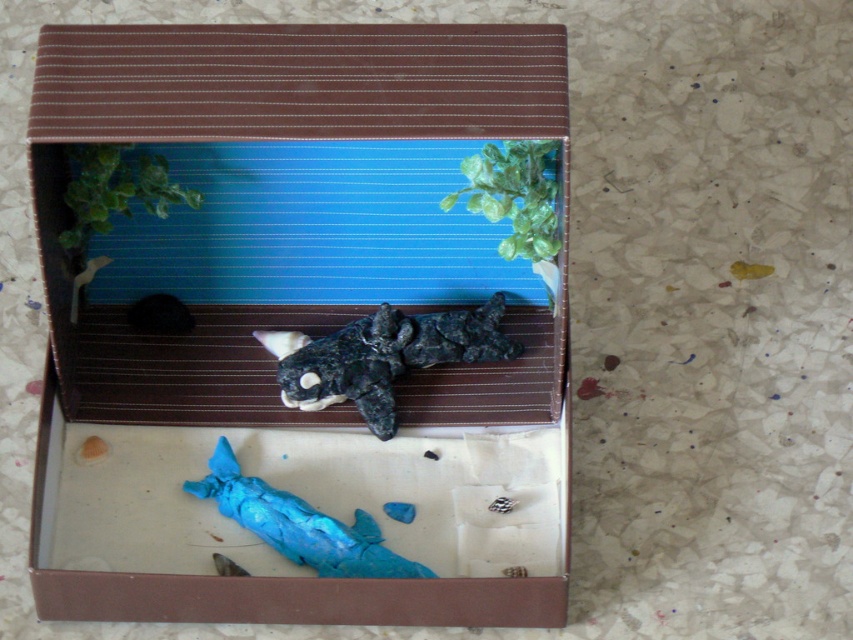
You are a tiny explorer who wants to place a small treasure in the exact center of the matte plastic box at center. Where should you place it?

The exact center of the matte plastic box at center is located at the coordinates point (294, 321).

You are a marine biologist examining the miniature diorama. You notice the matte black orca at center and the green matte plant at upper center. Based on their positions, which object is closer to the surface of the water in the upper section?

The green matte plant at upper center is closer to the surface of the water in the upper section because it is positioned above the matte black orca at center.

You are a marine biologist observing the miniature diorama. You notice a point marked at coordinates [383,356]. What object is located at this point?

The point at [383,356] corresponds to the matte black orca at center.